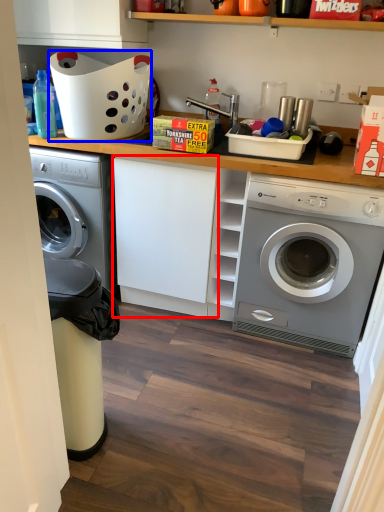
Question: Which point is closer to the camera, cabinetry (highlighted by a red box) or basket (highlighted by a blue box)?

Choices:
 (A) cabinetry
 (B) basket

Answer: (B)